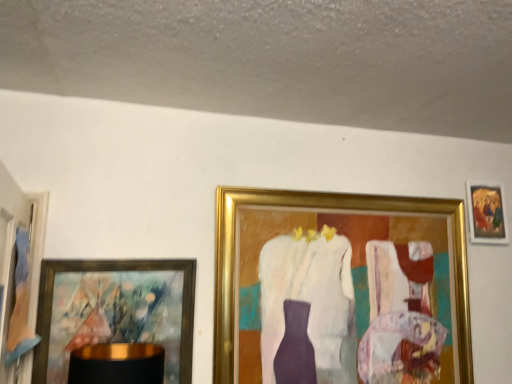
Question: Considering the positions of wooden picture frame at left, which is the 4th picture frame in right-to-left order, and gold-framed painting at left, which ranks as the third picture frame in right-to-left order, in the image, is wooden picture frame at left, which is the 4th picture frame in right-to-left order, bigger or smaller than gold-framed painting at left, which ranks as the third picture frame in right-to-left order,?

Choices:
 (A) big
 (B) small

Answer: (A)

Question: From the image's perspective, is wooden picture frame at left, positioned as the first picture frame in left-to-right order, located above or below gold-framed painting at left, which ranks as the third picture frame in right-to-left order?

Choices:
 (A) above
 (B) below

Answer: (A)

Question: Considering the real-world distances, which object is farthest from the gold-framed painting at left, which ranks as the third picture frame in right-to-left order?

Choices:
 (A) gold metallic picture frame at center, marked as the third picture frame in a left-to-right arrangement
 (B) gold-framed painting at upper right, which appears as the 4th picture frame when viewed from the left
 (C) wooden picture frame at left, positioned as the first picture frame in left-to-right order

Answer: (B)

Question: Considering the real-world distances, which object is closest to the gold metallic picture frame at center, the second picture frame viewed from the right?

Choices:
 (A) gold-framed painting at upper right, placed as the first picture frame when sorted from right to left
 (B) gold-framed painting at left, which ranks as the third picture frame in right-to-left order
 (C) wooden picture frame at left, which is the 4th picture frame in right-to-left order

Answer: (A)